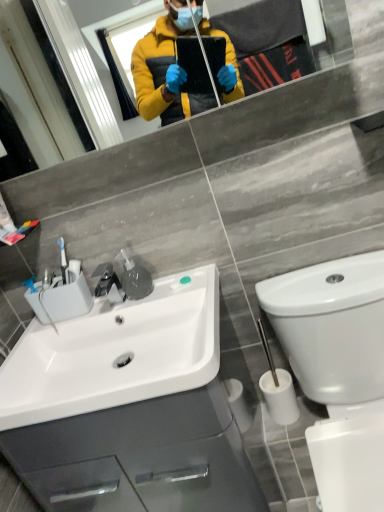
Question: Is the surface of white glossy toilet at lower right in direct contact with matte glass mirror at upper center?

Choices:
 (A) no
 (B) yes

Answer: (A)

Question: Can you confirm if white glossy toilet at lower right is positioned to the right of matte glass mirror at upper center?

Choices:
 (A) yes
 (B) no

Answer: (A)

Question: Is white glossy toilet at lower right taller than matte glass mirror at upper center?

Choices:
 (A) yes
 (B) no

Answer: (A)

Question: Are white glossy toilet at lower right and matte glass mirror at upper center far apart?

Choices:
 (A) yes
 (B) no

Answer: (A)

Question: From a real-world perspective, does white glossy toilet at lower right sit lower than matte glass mirror at upper center?

Choices:
 (A) no
 (B) yes

Answer: (B)

Question: Considering the relative sizes of white glossy toilet at lower right and matte glass mirror at upper center in the image provided, is white glossy toilet at lower right wider than matte glass mirror at upper center?

Choices:
 (A) no
 (B) yes

Answer: (B)

Question: Can you confirm if white glossy cabinet at lower left is shorter than white glossy sink at lower left?

Choices:
 (A) no
 (B) yes

Answer: (A)

Question: Does white glossy cabinet at lower left have a larger size compared to white glossy sink at lower left?

Choices:
 (A) no
 (B) yes

Answer: (B)

Question: From the image's perspective, is white glossy cabinet at lower left located beneath white glossy sink at lower left?

Choices:
 (A) no
 (B) yes

Answer: (B)

Question: Can you confirm if white glossy cabinet at lower left is taller than white glossy sink at lower left?

Choices:
 (A) no
 (B) yes

Answer: (B)

Question: Does white glossy cabinet at lower left have a smaller size compared to white glossy sink at lower left?

Choices:
 (A) no
 (B) yes

Answer: (A)

Question: Is white glossy cabinet at lower left positioned behind white glossy sink at lower left?

Choices:
 (A) yes
 (B) no

Answer: (A)

Question: Considering the relative positions of white glossy toilet at lower right and white glossy sink at lower left in the image provided, is white glossy toilet at lower right behind white glossy sink at lower left?

Choices:
 (A) no
 (B) yes

Answer: (A)